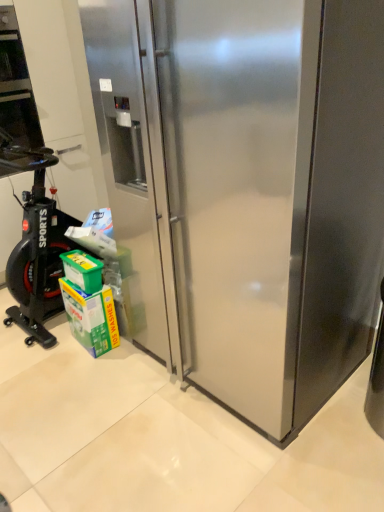
Question: Is black rubber exercise bike at left bigger than stainless steel refrigerator at center?

Choices:
 (A) no
 (B) yes

Answer: (A)

Question: Is black rubber exercise bike at left closer to the viewer compared to stainless steel refrigerator at center?

Choices:
 (A) yes
 (B) no

Answer: (B)

Question: Is black rubber exercise bike at left smaller than stainless steel refrigerator at center?

Choices:
 (A) no
 (B) yes

Answer: (B)

Question: Considering the relative positions of black rubber exercise bike at left and stainless steel refrigerator at center in the image provided, is black rubber exercise bike at left to the right of stainless steel refrigerator at center from the viewer's perspective?

Choices:
 (A) yes
 (B) no

Answer: (B)

Question: Is black rubber exercise bike at left further to the viewer compared to stainless steel refrigerator at center?

Choices:
 (A) no
 (B) yes

Answer: (B)

Question: Is black rubber exercise bike at left facing away from stainless steel refrigerator at center?

Choices:
 (A) yes
 (B) no

Answer: (B)

Question: Does green cardboard carton at lower left lie in front of black rubber exercise bike at left?

Choices:
 (A) no
 (B) yes

Answer: (B)

Question: Does green cardboard carton at lower left have a greater width compared to black rubber exercise bike at left?

Choices:
 (A) yes
 (B) no

Answer: (B)

Question: Can you confirm if green cardboard carton at lower left is positioned to the right of black rubber exercise bike at left?

Choices:
 (A) no
 (B) yes

Answer: (B)

Question: From the image's perspective, is green cardboard carton at lower left beneath black rubber exercise bike at left?

Choices:
 (A) yes
 (B) no

Answer: (A)

Question: From a real-world perspective, is green cardboard carton at lower left positioned over black rubber exercise bike at left based on gravity?

Choices:
 (A) yes
 (B) no

Answer: (B)

Question: From the image's perspective, is green cardboard carton at lower left located above black rubber exercise bike at left?

Choices:
 (A) no
 (B) yes

Answer: (A)

Question: Does green plastic box at lower left have a greater width compared to green cardboard carton at lower left?

Choices:
 (A) no
 (B) yes

Answer: (B)